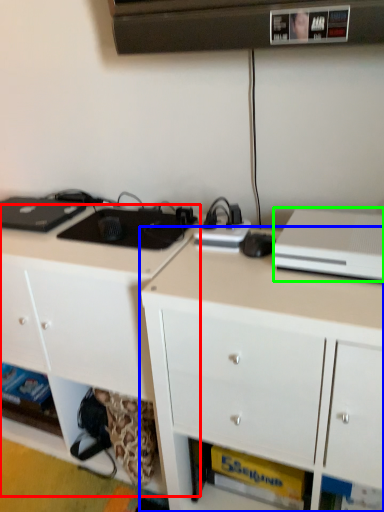
Question: Which object is the farthest from cabinetry (highlighted by a red box)? Choose among these: cabinetry (highlighted by a blue box) or desktop computer (highlighted by a green box).

Choices:
 (A) cabinetry
 (B) desktop computer

Answer: (B)